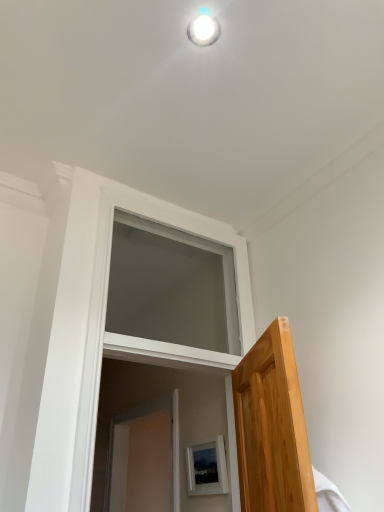
Locate an element on the screen. The height and width of the screenshot is (512, 384). white matte window at center is located at coordinates (171, 287).

What do you see at coordinates (203, 30) in the screenshot?
I see `white glossy light fixture at upper center` at bounding box center [203, 30].

Measure the distance between white glossy light fixture at upper center and camera.

The depth of white glossy light fixture at upper center is 4.19 feet.

Find the location of a particular element. This screenshot has width=384, height=512. matte white picture frame at lower center is located at coordinates (207, 468).

Is matte white picture frame at lower center not near white matte window at center?

No, matte white picture frame at lower center is in close proximity to white matte window at center.

Based on the photo, from the image's perspective, is matte white picture frame at lower center located above or below white matte window at center?

Clearly, from the image's perspective, matte white picture frame at lower center is below white matte window at center.

Where is `window on the left of matte white picture frame at lower center`? The image size is (384, 512). window on the left of matte white picture frame at lower center is located at coordinates (171, 287).

Is matte white picture frame at lower center facing towards white matte window at center?

No, matte white picture frame at lower center is not turned towards white matte window at center.

Where is `light fixture on the right of white matte window at center`? The height and width of the screenshot is (512, 384). light fixture on the right of white matte window at center is located at coordinates (203, 30).

Could you tell me if white glossy light fixture at upper center is turned towards white matte window at center?

No, white glossy light fixture at upper center is not oriented towards white matte window at center.

Who is taller, white glossy light fixture at upper center or white matte window at center?

white matte window at center is taller.

Between white glossy light fixture at upper center and white matte window at center, which one has larger size?

With larger size is white matte window at center.

Is white matte window at center located outside white glossy light fixture at upper center?

Yes, white matte window at center is outside of white glossy light fixture at upper center.

Looking at this image, is white matte window at center in contact with white glossy light fixture at upper center?

Answer: No, white matte window at center is not touching white glossy light fixture at upper center.

How many degrees apart are the facing directions of white matte window at center and white glossy light fixture at upper center?

The angle between the facing direction of white matte window at center and the facing direction of white glossy light fixture at upper center is 1.75 degrees.

Considering the sizes of white matte window at center and white glossy light fixture at upper center in the image, is white matte window at center bigger or smaller than white glossy light fixture at upper center?

Considering their sizes, white matte window at center takes up more space than white glossy light fixture at upper center.

Can you confirm if white matte window at center is shorter than matte white picture frame at lower center?

No.

From a real-world perspective, is white matte window at center physically located above or below matte white picture frame at lower center?

white matte window at center is situated higher than matte white picture frame at lower center in the real world.

Is white matte window at center outside of matte white picture frame at lower center?

Yes, white matte window at center is not within matte white picture frame at lower center.

Which of these two, matte white picture frame at lower center or white glossy light fixture at upper center, is wider?

With larger width is white glossy light fixture at upper center.

Is matte white picture frame at lower center to the left or to the right of white glossy light fixture at upper center in the image?

From the image, it's evident that matte white picture frame at lower center is to the right of white glossy light fixture at upper center.

Is matte white picture frame at lower center oriented towards white glossy light fixture at upper center?

No.

Is matte white picture frame at lower center next to white glossy light fixture at upper center and touching it?

No, matte white picture frame at lower center is not touching white glossy light fixture at upper center.

Is white glossy light fixture at upper center completely or partially outside of matte white picture frame at lower center?

Yes.

Considering the relative sizes of white glossy light fixture at upper center and matte white picture frame at lower center in the image provided, is white glossy light fixture at upper center thinner than matte white picture frame at lower center?

Incorrect, the width of white glossy light fixture at upper center is not less than that of matte white picture frame at lower center.

Is white glossy light fixture at upper center further to the viewer compared to matte white picture frame at lower center?

No, white glossy light fixture at upper center is closer to the camera.

Identify the location of picture frame behind the white matte window at center. The height and width of the screenshot is (512, 384). (207, 468).

I want to click on light fixture in front of the white matte window at center, so click(x=203, y=30).

Which object lies nearer to the anchor point white matte window at center, matte white picture frame at lower center or white glossy light fixture at upper center?

matte white picture frame at lower center lies closer to white matte window at center than the other object.

Looking at the image, which one is located closer to white matte window at center, white glossy light fixture at upper center or matte white picture frame at lower center?

matte white picture frame at lower center is closer to white matte window at center.

Looking at the image, which one is located further to matte white picture frame at lower center, white matte window at center or white glossy light fixture at upper center?

white glossy light fixture at upper center lies further to matte white picture frame at lower center than the other object.

Estimate the real-world distances between objects in this image. Which object is closer to white glossy light fixture at upper center, matte white picture frame at lower center or white matte window at center?

Among the two, white matte window at center is located nearer to white glossy light fixture at upper center.

Estimate the real-world distances between objects in this image. Which object is further from white glossy light fixture at upper center, white matte window at center or matte white picture frame at lower center?

matte white picture frame at lower center is further to white glossy light fixture at upper center.

Looking at the image, which one is located further to matte white picture frame at lower center, white glossy light fixture at upper center or white matte window at center?

white glossy light fixture at upper center is further to matte white picture frame at lower center.

The height and width of the screenshot is (512, 384). I want to click on window between white glossy light fixture at upper center and matte white picture frame at lower center vertically, so click(171, 287).